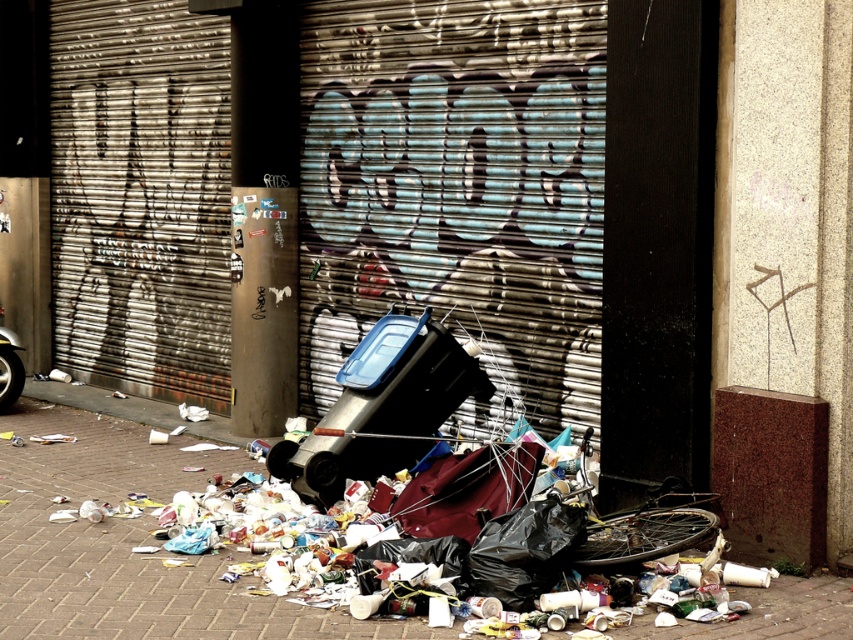
Question: Which of the following is the closest to the observer?

Choices:
 (A) brushed metal garage door at center
 (B) brick pavement at lower center

Answer: (B)

Question: Which point is farther to the camera?

Choices:
 (A) brick pavement at lower center
 (B) brushed metal garage door at center

Answer: (B)

Question: Can you confirm if brushed metal garage door at center is smaller than brick pavement at lower center?

Choices:
 (A) no
 (B) yes

Answer: (A)

Question: Among these points, which one is nearest to the camera?

Choices:
 (A) [x=102, y=628]
 (B) [x=643, y=486]

Answer: (A)

Question: In this image, where is brushed metal garage door at center located relative to brick pavement at lower center?

Choices:
 (A) right
 (B) left

Answer: (A)

Question: Observing the image, what is the correct spatial positioning of brushed metal garage door at center in reference to brick pavement at lower center?

Choices:
 (A) above
 (B) below

Answer: (A)